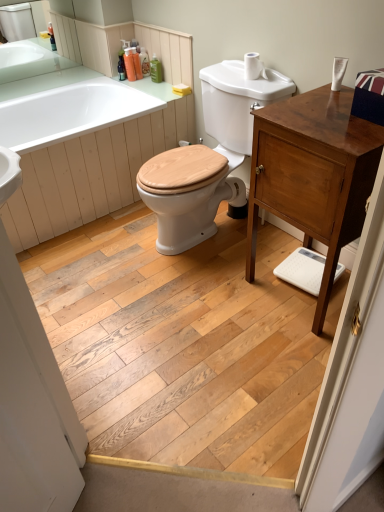
This screenshot has width=384, height=512. In order to click on vacant area situated to the left side of white matte toilet paper at upper right in this screenshot , I will do `click(234, 75)`.